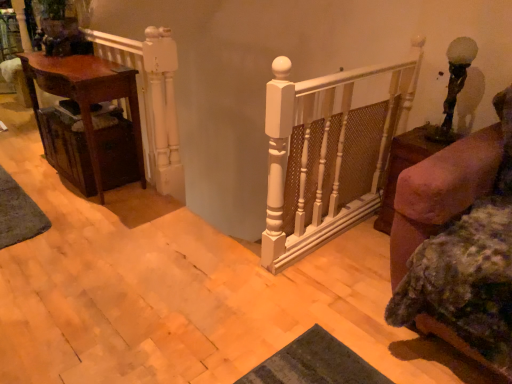
Question: Relative to matte brown table at left, is white painted wood railing at upper left in front or behind?

Choices:
 (A) front
 (B) behind

Answer: (A)

Question: Do you think white painted wood railing at upper left is within matte brown table at left, or outside of it?

Choices:
 (A) inside
 (B) outside

Answer: (B)

Question: Which is farther from the white painted wood railing at upper left?

Choices:
 (A) matte brown table at left
 (B) brown wooden side table at right
 (C) green textured mat at lower left
 (D) woven brown drawer at left

Answer: (B)

Question: Estimate the real-world distances between objects in this image. Which object is closer to the brown wooden side table at right?

Choices:
 (A) white painted wood railing at upper left
 (B) woven brown drawer at left
 (C) matte brown table at left
 (D) green textured mat at lower left

Answer: (A)